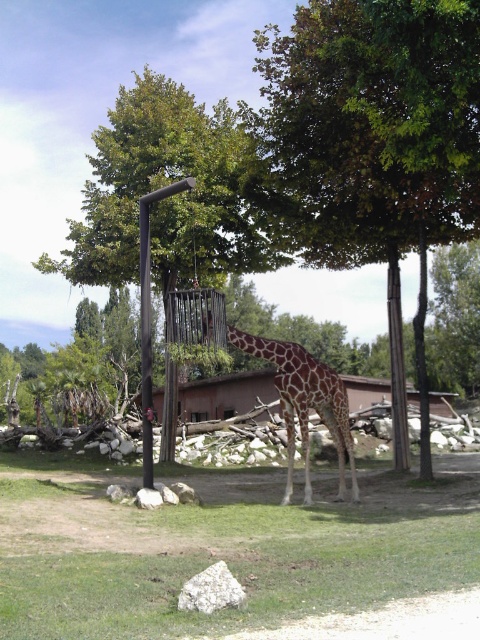
You are a zookeeper trying to feed the spotted fur giraffe at center. The feeder is attached to the black metal pole at center. Since the pole is in the way, can you still reach the feeder to refill it?

The black metal pole at center is behind the spotted fur giraffe at center, so you can still reach the feeder attached to the pole as the giraffe is in front of it, allowing access from the front side.

You are a zookeeper trying to determine if the spotted fur giraffe at center can fit through a narrow gate that is the same width as the black metal pole at center. Can the giraffe pass through the gate?

The spotted fur giraffe at center is thinner than the black metal pole at center, so yes, the giraffe can pass through the gate since its width is less than the pole.